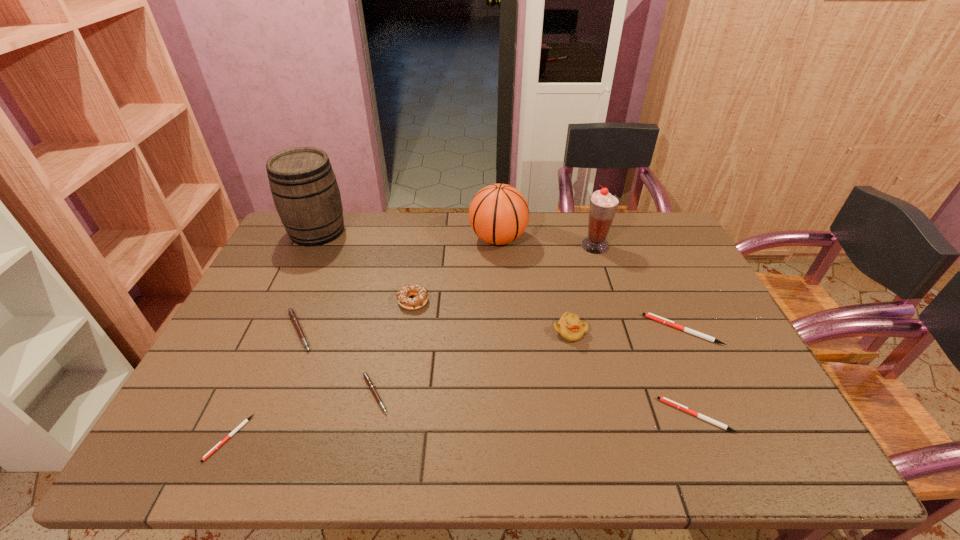
I want to click on free space located on the front of the chocolate doughnut, so click(x=394, y=418).

You are a GUI agent. You are given a task and a screenshot of the screen. Output one action in this format:
    pyautogui.click(x=<x>, y=<y>)
    Task: Click on the free space located 0.370m at the nib of the bigger pink pen
    This screenshot has width=960, height=540.
    Given the screenshot: What is the action you would take?
    point(452,330)

Where is `vacant space situated 0.160m on the clicker of the biggest white pen`? The height and width of the screenshot is (540, 960). vacant space situated 0.160m on the clicker of the biggest white pen is located at coordinates (589, 330).

This screenshot has width=960, height=540. Identify the location of vacant space situated on the clicker of the biggest white pen. (557, 330).

At what (x,y) coordinates should I click in order to perform the action: click on vacant area situated 0.050m on the clicker of the biggest white pen. Please return your answer as a coordinate pair (x, y). The width and height of the screenshot is (960, 540). Looking at the image, I should click on (629, 330).

At what (x,y) coordinates should I click in order to perform the action: click on free space located at the nib of the third pen from right to left. Please return your answer as a coordinate pair (x, y). This screenshot has height=540, width=960. Looking at the image, I should click on (516, 394).

Locate an element on the screen. This screenshot has width=960, height=540. vacant position located on the clicker of the second smallest white pen is located at coordinates (502, 415).

At what (x,y) coordinates should I click in order to perform the action: click on vacant space located 0.190m on the clicker of the second smallest white pen. Please return your answer as a coordinate pair (x, y). This screenshot has width=960, height=540. Looking at the image, I should click on (580, 415).

Identify the location of free region located 0.070m on the clicker of the second smallest white pen. The height and width of the screenshot is (540, 960). (632, 415).

Where is `wine bucket that is at the far edge`? Image resolution: width=960 pixels, height=540 pixels. wine bucket that is at the far edge is located at coordinates (304, 188).